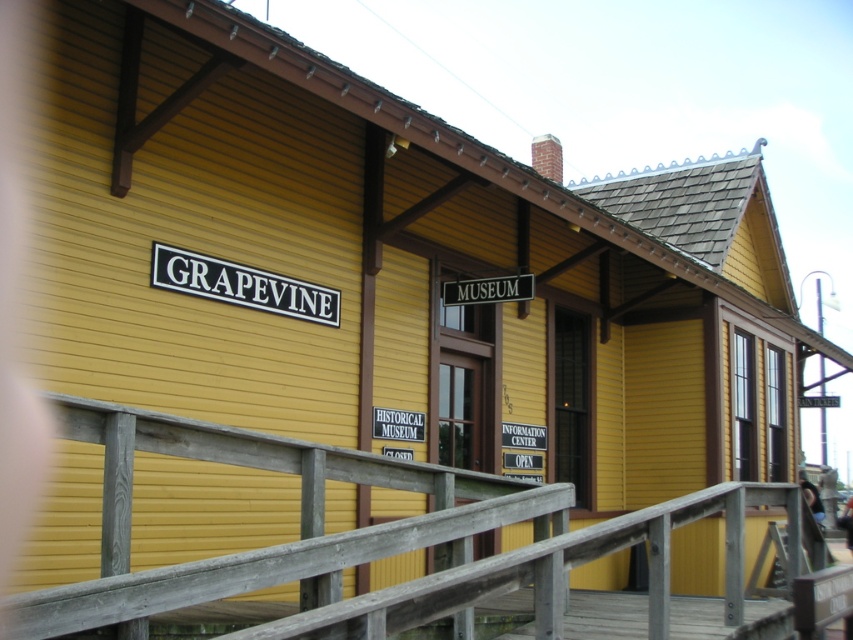
Question: Which point appears farthest from the camera in this image?

Choices:
 (A) (461, 292)
 (B) (450, 532)

Answer: (A)

Question: Is wooden at center positioned before black metal sign at center?

Choices:
 (A) no
 (B) yes

Answer: (B)

Question: Is wooden at center closer to camera compared to black metal sign at center?

Choices:
 (A) yes
 (B) no

Answer: (A)

Question: Among these points, which one is farthest from the camera?

Choices:
 (A) (173, 602)
 (B) (520, 276)

Answer: (B)

Question: Is wooden at center below black metal sign at center?

Choices:
 (A) no
 (B) yes

Answer: (B)